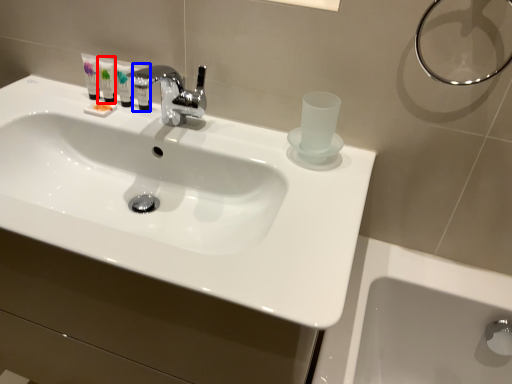
Question: Which of the following is the closest to the observer, mouthwash (highlighted by a red box) or mouthwash (highlighted by a blue box)?

Choices:
 (A) mouthwash
 (B) mouthwash

Answer: (B)